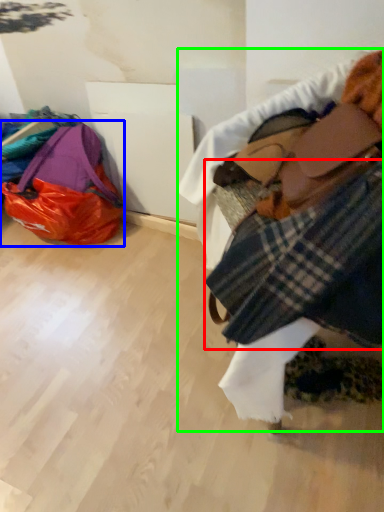
Question: Based on their relative distances, which object is nearer to flannel (highlighted by a red box)? Choose from luggage and bags (highlighted by a blue box) and textile (highlighted by a green box).

Choices:
 (A) luggage and bags
 (B) textile

Answer: (B)